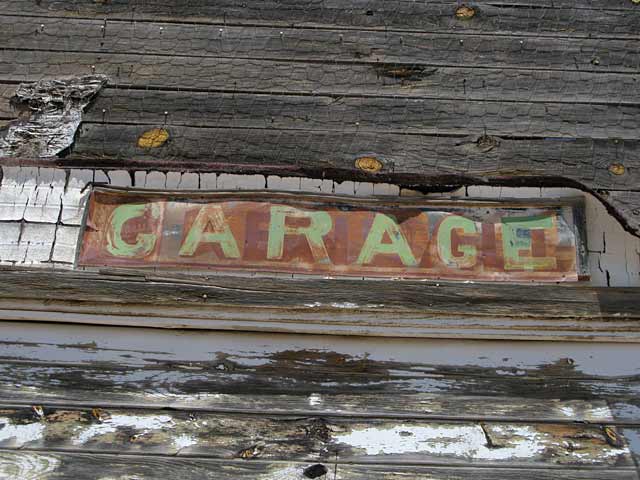
In order to click on white paint peeling off boards in this screenshot , I will do `click(372, 443)`, `click(144, 382)`, `click(148, 338)`, `click(189, 323)`.